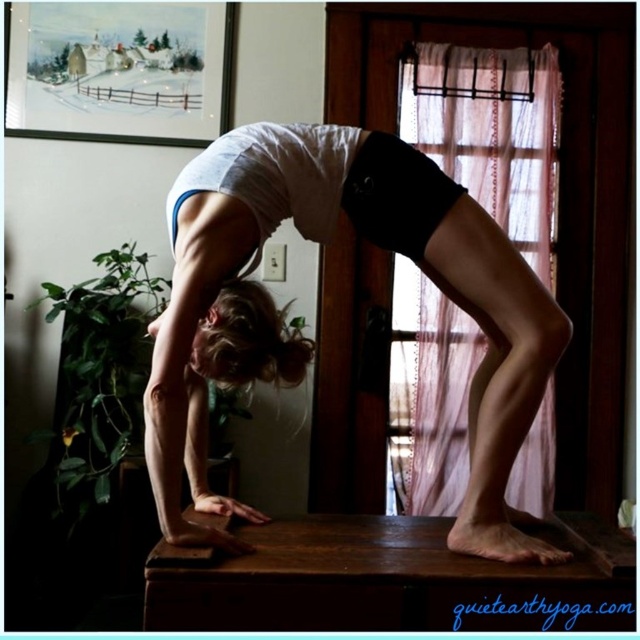
Can you confirm if white cotton shirt at center is positioned above sheer pink fabric at upper center?

Actually, white cotton shirt at center is below sheer pink fabric at upper center.

Who is lower down, white cotton shirt at center or sheer pink fabric at upper center?

Positioned lower is white cotton shirt at center.

Identify the location of white cotton shirt at center. The image size is (640, 640). (308, 339).